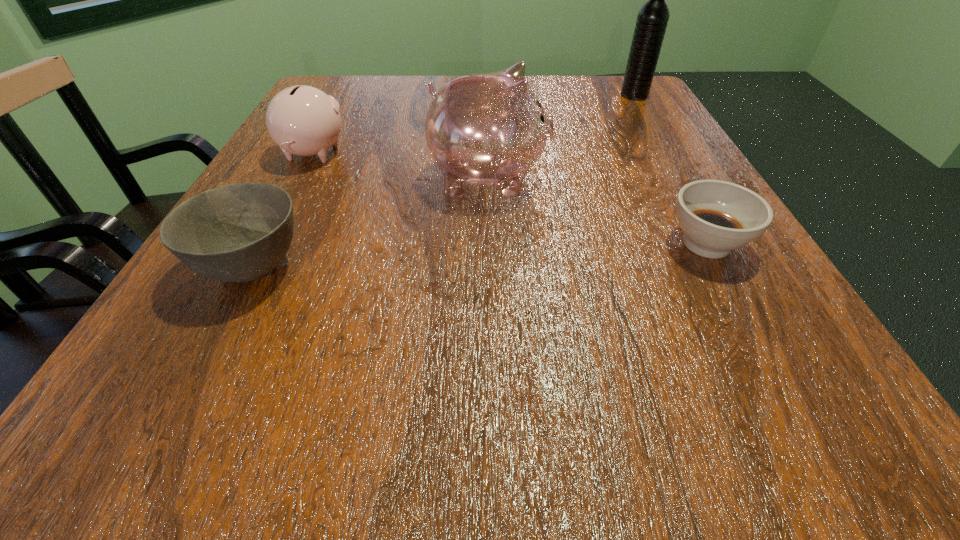
Image resolution: width=960 pixels, height=540 pixels. I want to click on blank region between the bowl and the water bottle, so (444, 181).

At what (x,y) coordinates should I click in order to perform the action: click on vacant area between the soup bowl and the second shortest object. Please return your answer as a coordinate pair (x, y). This screenshot has height=540, width=960. Looking at the image, I should click on (480, 255).

The image size is (960, 540). What are the coordinates of `free spot between the farthest object and the second tallest object` in the screenshot? It's located at coord(562,137).

Where is `object that stands as the third closest to the shortest object`? The height and width of the screenshot is (540, 960). object that stands as the third closest to the shortest object is located at coordinates (240, 232).

The width and height of the screenshot is (960, 540). I want to click on object that can be found as the second closest to the soup bowl, so click(652, 19).

Identify the location of vacant position in the image that satisfies the following two spatial constraints: 1. on the front facing side of the fourth shortest object; 2. on the front side of the third shortest object. The image size is (960, 540). (488, 154).

At what (x,y) coordinates should I click in order to perform the action: click on free spot that satisfies the following two spatial constraints: 1. on the front facing side of the third object from left to right; 2. on the right side of the water bottle. Please return your answer as a coordinate pair (x, y). Looking at the image, I should click on (487, 95).

The image size is (960, 540). Identify the location of vacant space that satisfies the following two spatial constraints: 1. on the front facing side of the water bottle; 2. on the right side of the taller piggy bank. (487, 95).